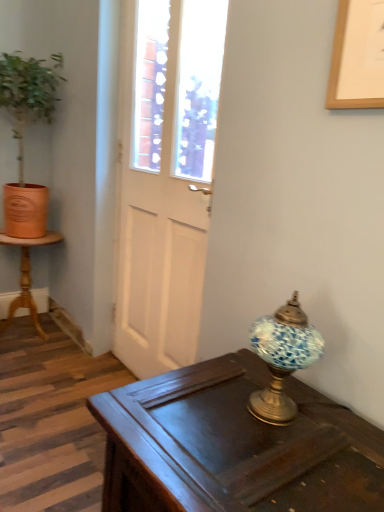
Locate an element on the screen. vacant region in front of wooden pedestal table at left is located at coordinates (33, 358).